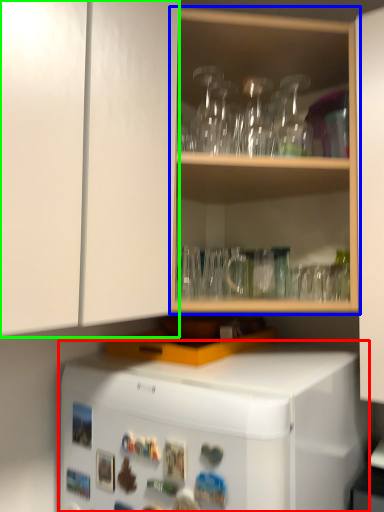
Question: Based on their relative distances, which object is farther from refrigerator (highlighted by a red box)? Choose from shelf (highlighted by a blue box) and cabinetry (highlighted by a green box).

Choices:
 (A) shelf
 (B) cabinetry

Answer: (A)